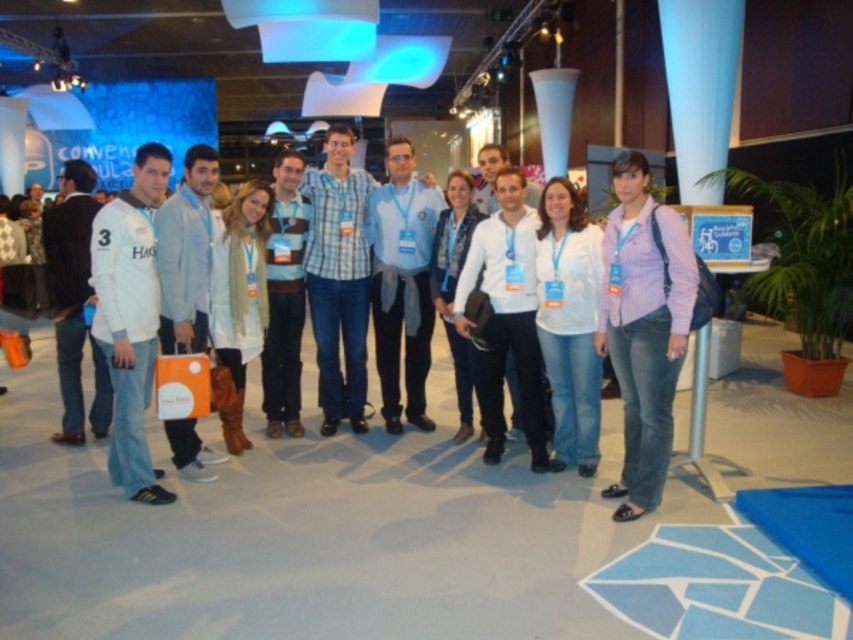
You are a photographer at the event and want to ensure that all attendees are visible in the photo. Since the striped cotton shirt at center and white cotton shirt at center are overlapping, which one should you ask to move slightly backward to make sure both are visible?

The striped cotton shirt at center is in front of the white cotton shirt at center, so you should ask the person wearing the striped cotton shirt at center to move slightly backward to ensure both are visible.

You are a photographer at the event and want to ensure that both the striped cotton shirt at center and the white cotton shirt at center are clearly visible in the photo. Which shirt should you adjust to the left to make space for the other?

The striped cotton shirt at center is to the right of the white cotton shirt at center. To make space for the other, you should adjust the striped cotton shirt at center to the left.